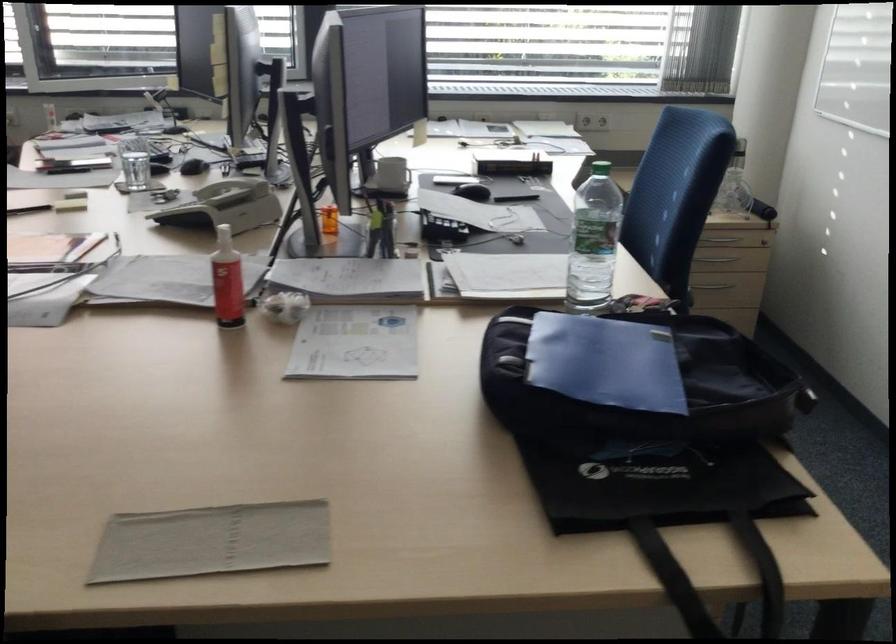
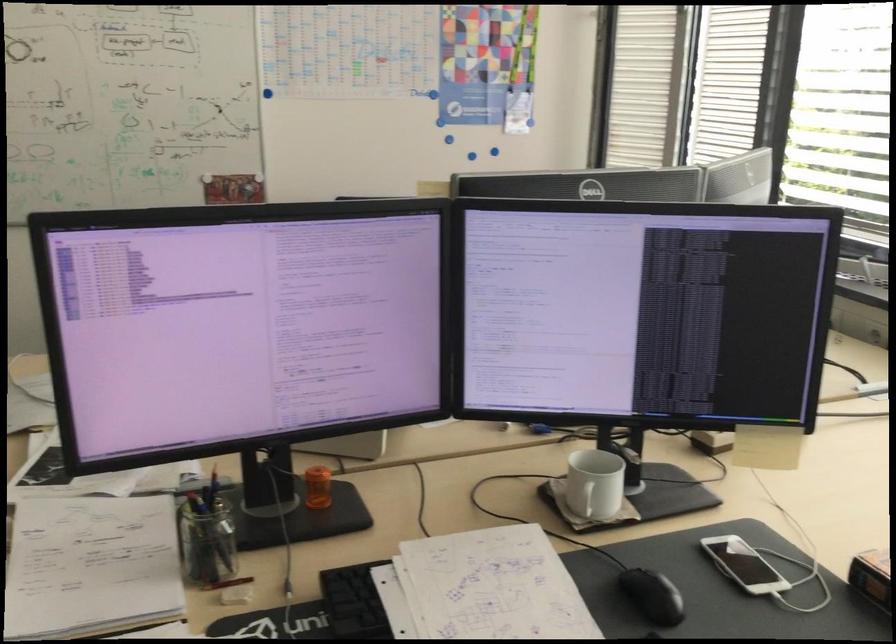
Locate, in the second image, the point that corresponds to [385,232] in the first image.

(205, 538)